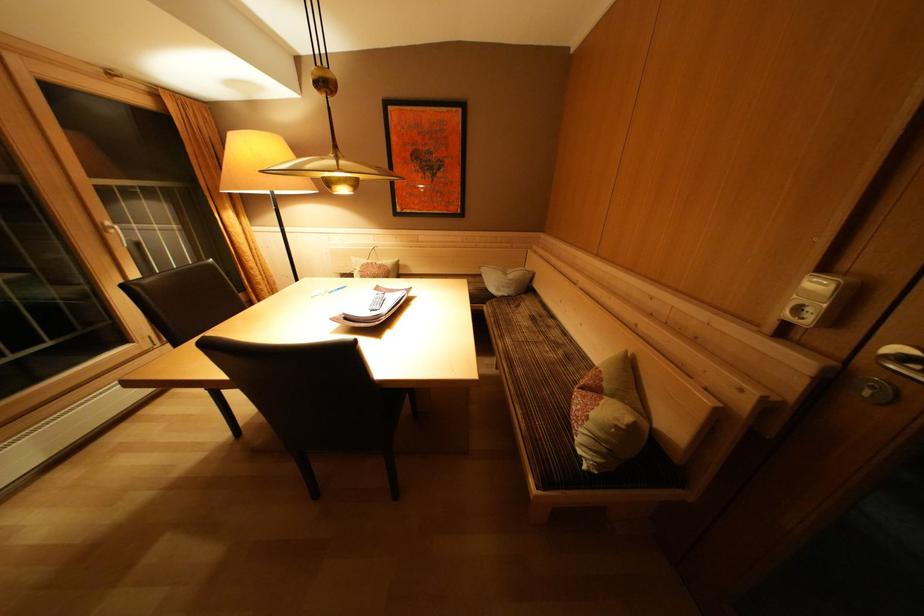
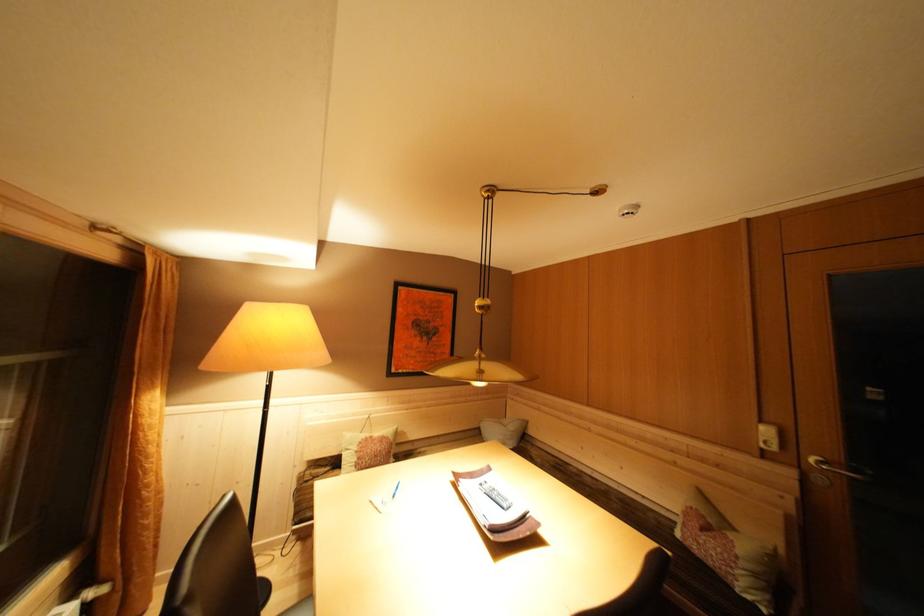
The point at (521,280) is marked in the first image. Where is the corresponding point in the second image?

(518, 430)